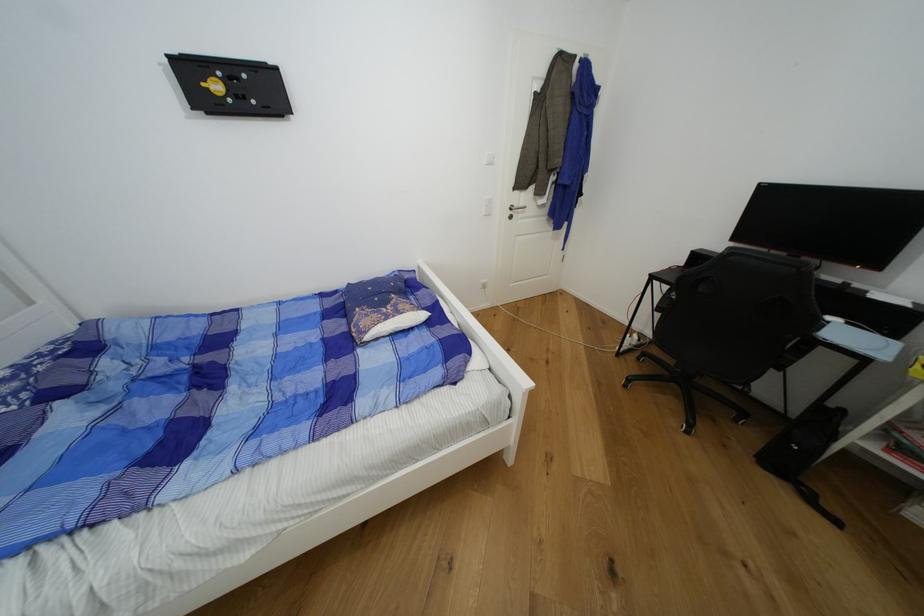
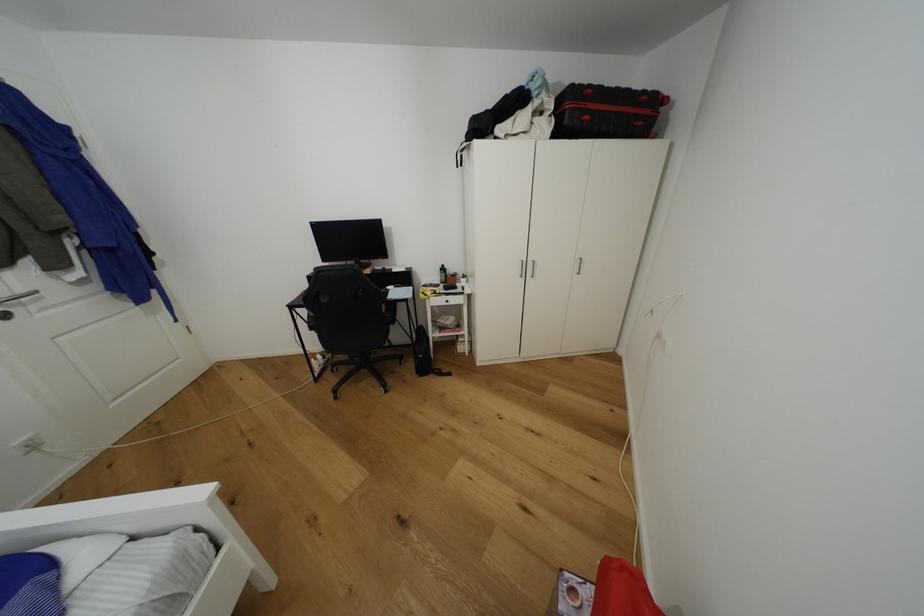
Question: The camera is either moving clockwise (left) or counter-clockwise (right) around the object. The first image is from the beginning of the video and the second image is from the end. Is the camera moving left or right when shooting the video?

Choices:
 (A) Left
 (B) Right

Answer: (A)